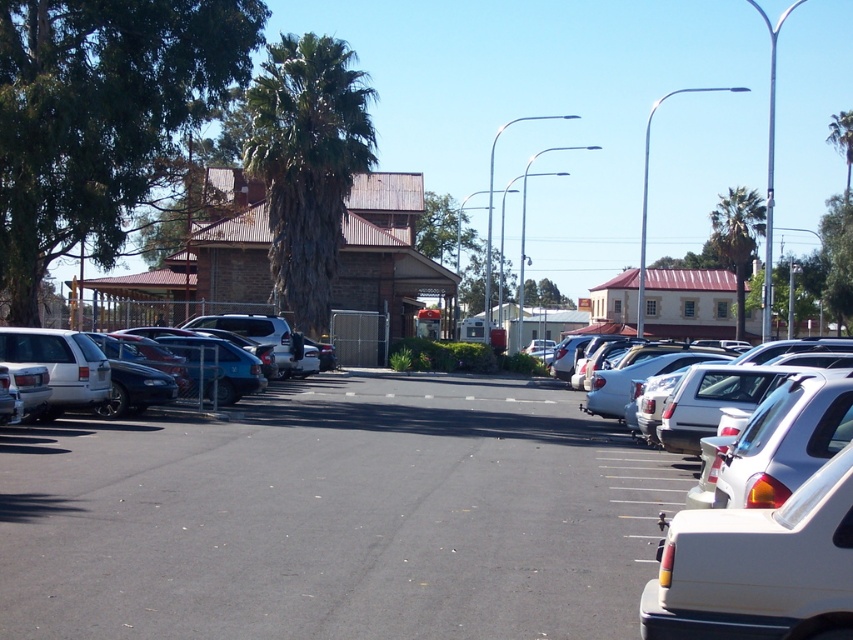
You are a delivery person who needs to park your 1.8 meters tall delivery box next to the matte black sedan at left. Can the delivery box be placed under the green leafy palm tree at center without hitting its branches?

The green leafy palm tree at center is taller than the matte black sedan at left. Since the delivery box is 1.8 meters tall, and the palm tree is taller than the sedan, it is likely that the branches are also above 1.8 meters. Therefore, placing the delivery box under the tree might be possible without hitting the branches, but it depends on the tree canopy height. However, based on the given information, the tree is taller than the sedan, so the branches could be higher than the box.

You are a delivery person trying to park your van in the parking lot. The white matte car at center and the matte black sedan at left are blocking your path. Which vehicle should you move first to clear the path?

The white matte car at center is below the matte black sedan at left, so you should move the matte black sedan at left first because it is positioned higher and might be blocking access to the lower area where the white matte car is parked.

You are a delivery person trying to park a new white matte car that is the same size as the white matte car at right. The parking space at center is only designed for cars the size of the white matte car at center. Will your new car fit in the center parking space?

The white matte car at center is smaller than the white matte car at right. Since your new car is the same size as the white matte car at right, it will be too large to fit in the center parking space designed for the smaller car.